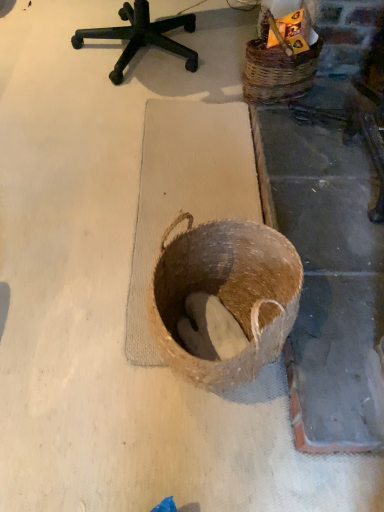
This screenshot has width=384, height=512. Identify the location of free region on the left part of brown woven basket at center, which is counted as the second basket, starting from the right. (88, 342).